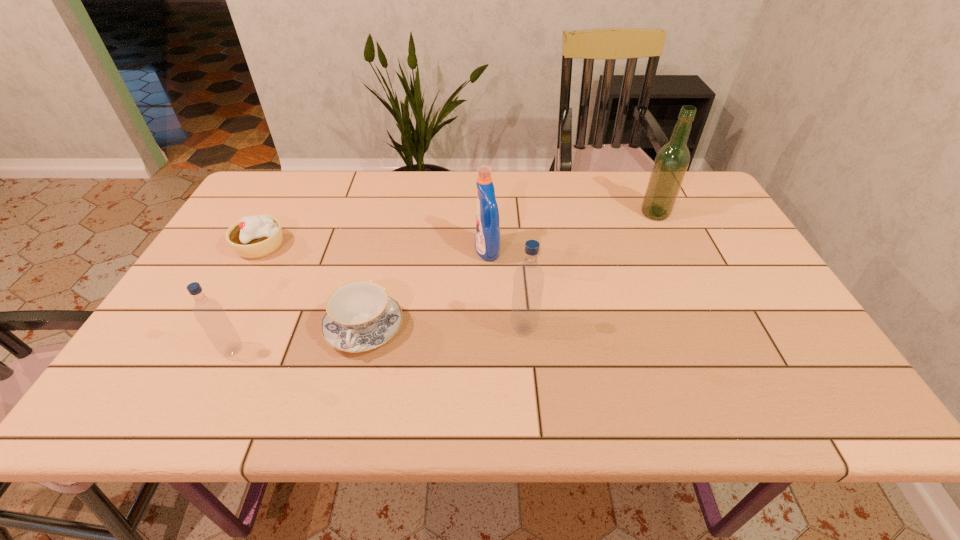
I want to click on vacant region between the farthest object and the whipped cream, so click(x=458, y=230).

Identify the location of free space between the fourth object from left to right and the tallest object. The height and width of the screenshot is (540, 960). (571, 232).

This screenshot has height=540, width=960. What are the coordinates of `blank region between the shorter water bottle and the shortest object` in the screenshot? It's located at (299, 340).

Locate an element on the screen. free spot between the shortest object and the whipped cream is located at coordinates (312, 287).

What are the coordinates of `free space between the third object from right to left and the taller water bottle` in the screenshot? It's located at (506, 289).

This screenshot has width=960, height=540. Identify the location of vacant area that lies between the liquor and the shorter water bottle. (444, 282).

This screenshot has height=540, width=960. I want to click on free space between the fifth object from left to right and the shortest object, so click(444, 328).

Locate an element on the screen. The width and height of the screenshot is (960, 540). vacant space in between the taller water bottle and the liquor is located at coordinates (589, 271).

The image size is (960, 540). I want to click on the closest object relative to the farther water bottle, so click(487, 235).

Find the location of a particular element. Image resolution: width=960 pixels, height=540 pixels. object that is the fifth closest to the whipped cream is located at coordinates (672, 160).